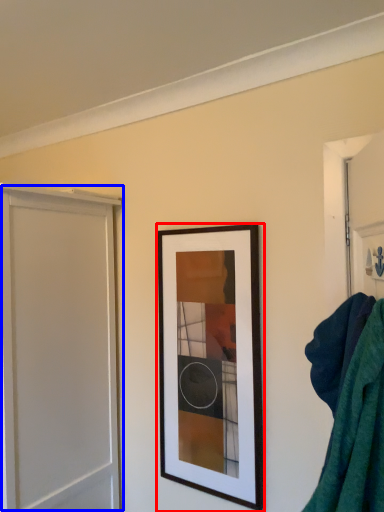
Question: Which of the following is the closest to the observer, picture frame (highlighted by a red box) or screen door (highlighted by a blue box)?

Choices:
 (A) picture frame
 (B) screen door

Answer: (B)